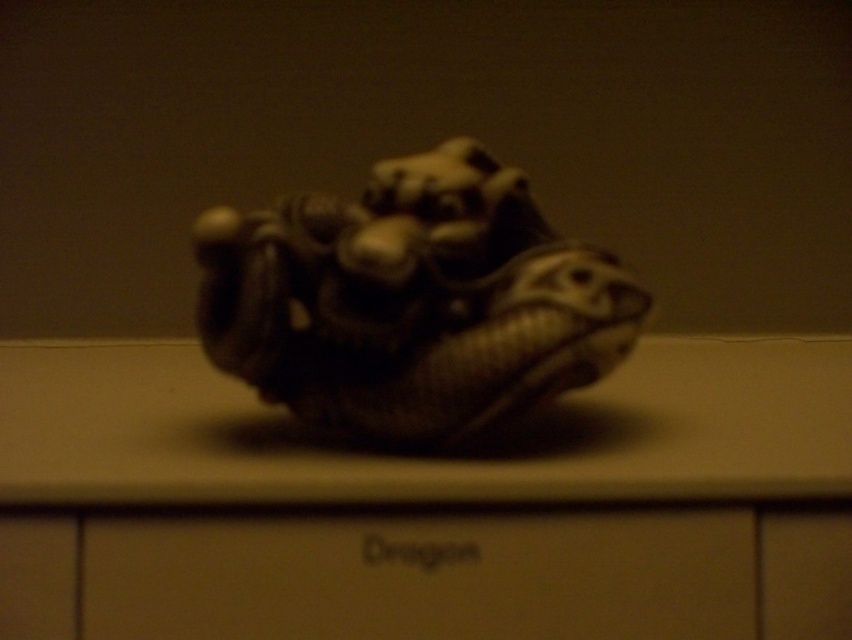
Question: Which point is farther from the camera taking this photo?

Choices:
 (A) (243, 300)
 (B) (643, 556)

Answer: (A)

Question: Among these objects, which one is farthest from the camera?

Choices:
 (A) matte stone dragon at center
 (B) matte brown drawer at center

Answer: (B)

Question: Where is matte stone dragon at center located in relation to matte brown drawer at center in the image?

Choices:
 (A) left
 (B) right

Answer: (B)

Question: Can you confirm if matte stone dragon at center is positioned below matte brown drawer at center?

Choices:
 (A) yes
 (B) no

Answer: (B)

Question: Is matte stone dragon at center bigger than matte brown drawer at center?

Choices:
 (A) yes
 (B) no

Answer: (A)